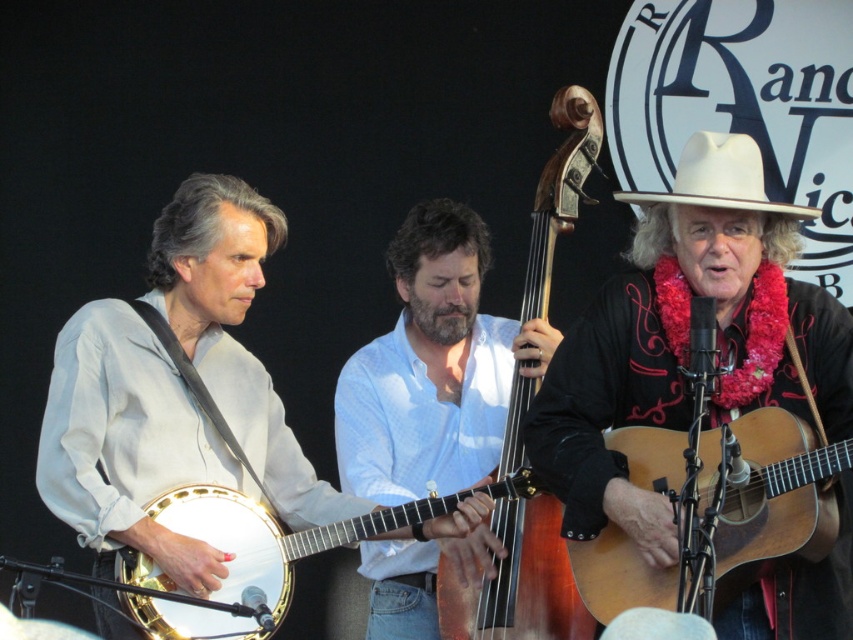
Is the position of light blue woven shirt at center more distant than that of light brown wooden guitar at right?

Yes, light blue woven shirt at center is behind light brown wooden guitar at right.

Where is `light blue woven shirt at center`? The width and height of the screenshot is (853, 640). light blue woven shirt at center is located at coordinates (433, 368).

Which is in front, point (247, 291) or point (811, 552)?

Point (811, 552)

Who is shorter, white matte banjo at left or light brown wooden guitar at right?

light brown wooden guitar at right

At what (x,y) coordinates should I click in order to perform the action: click on white matte banjo at left. Please return your answer as a coordinate pair (x, y). Looking at the image, I should click on (126, 444).

Find the location of `white matte banjo at left`. white matte banjo at left is located at coordinates (126, 444).

Is white matte banjo at left to the left of light blue woven shirt at center from the viewer's perspective?

Yes, white matte banjo at left is to the left of light blue woven shirt at center.

What do you see at coordinates (126, 444) in the screenshot? I see `white matte banjo at left` at bounding box center [126, 444].

Identify the location of white matte banjo at left. Image resolution: width=853 pixels, height=640 pixels. (126, 444).